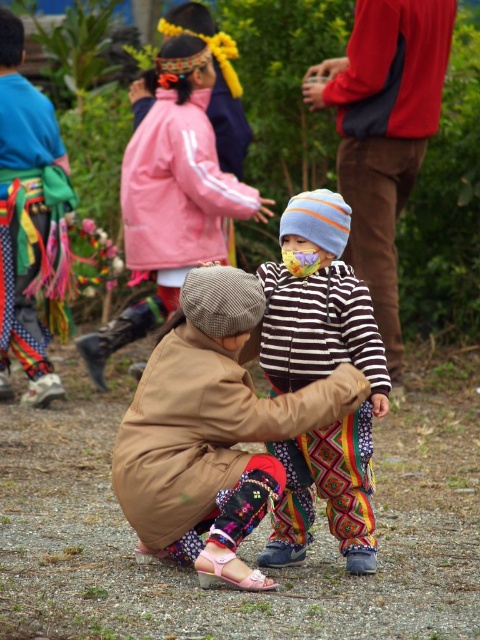
Which is in front, point (394, 371) or point (16, 244)?

Point (16, 244) is more forward.

Does point (441, 92) lie in front of point (24, 250)?

No, (441, 92) is further to viewer.

I want to click on striped hoodie at center, so click(x=384, y=132).

Does brown fabric jacket at center have a greater width compared to striped hoodie at center?

In fact, brown fabric jacket at center might be narrower than striped hoodie at center.

Does point (237, 570) come closer to viewer compared to point (385, 77)?

Yes.

Measure the distance between point (153,493) and camera.

Point (153,493) and camera are 14.49 feet apart.

Identify the location of brown fabric jacket at center. This screenshot has width=480, height=640. (212, 429).

Can you confirm if brown fabric jacket at center is smaller than brushed metal belt at left?

Yes, brown fabric jacket at center is smaller than brushed metal belt at left.

The height and width of the screenshot is (640, 480). Find the location of `brown fabric jacket at center`. brown fabric jacket at center is located at coordinates (212, 429).

Image resolution: width=480 pixels, height=640 pixels. What do you see at coordinates (212, 429) in the screenshot?
I see `brown fabric jacket at center` at bounding box center [212, 429].

Image resolution: width=480 pixels, height=640 pixels. I want to click on brown fabric jacket at center, so click(x=212, y=429).